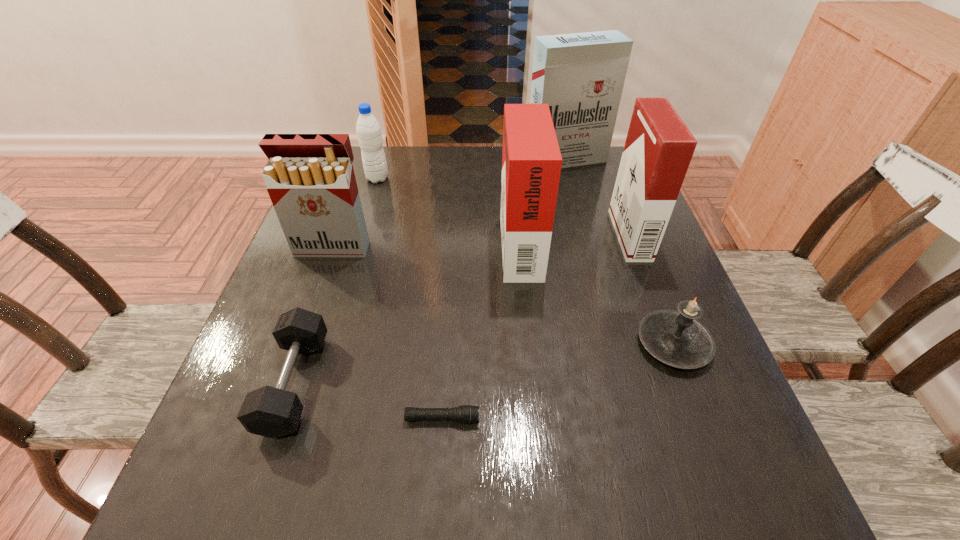
This screenshot has height=540, width=960. What are the coordinates of `unoccupied area between the shortest object and the dumbbell` in the screenshot? It's located at (369, 401).

This screenshot has width=960, height=540. I want to click on object that is the sixth closest to the shortest object, so click(x=368, y=129).

Choose which object is the fourth nearest neighbor to the fifth tallest object. Please provide its 2D coordinates. Your answer should be formatted as a tuple, i.e. [(x, y)], where the tuple contains the x and y coordinates of a point satisfying the conditions above.

[(273, 412)]

Where is `cigarette case identified as the second closest to the sixth tallest object`? The width and height of the screenshot is (960, 540). cigarette case identified as the second closest to the sixth tallest object is located at coordinates (531, 160).

Identify which cigarette case is the second closest to the fourth shortest object. Please provide its 2D coordinates. Your answer should be formatted as a tuple, i.e. [(x, y)], where the tuple contains the x and y coordinates of a point satisfying the conditions above.

[(531, 160)]

I want to click on free space that satisfies the following two spatial constraints: 1. on the back side of the seventh tallest object; 2. on the left side of the farthest object, so click(x=371, y=159).

You are a GUI agent. You are given a task and a screenshot of the screen. Output one action in this format:
    pyautogui.click(x=<x>, y=<y>)
    Task: Click on the vacant region that satisfies the following two spatial constraints: 1. with the lid open on the dumbbell; 2. on the left side of the leftmost cigarette case
    The height and width of the screenshot is (540, 960).
    Given the screenshot: What is the action you would take?
    pyautogui.click(x=284, y=383)